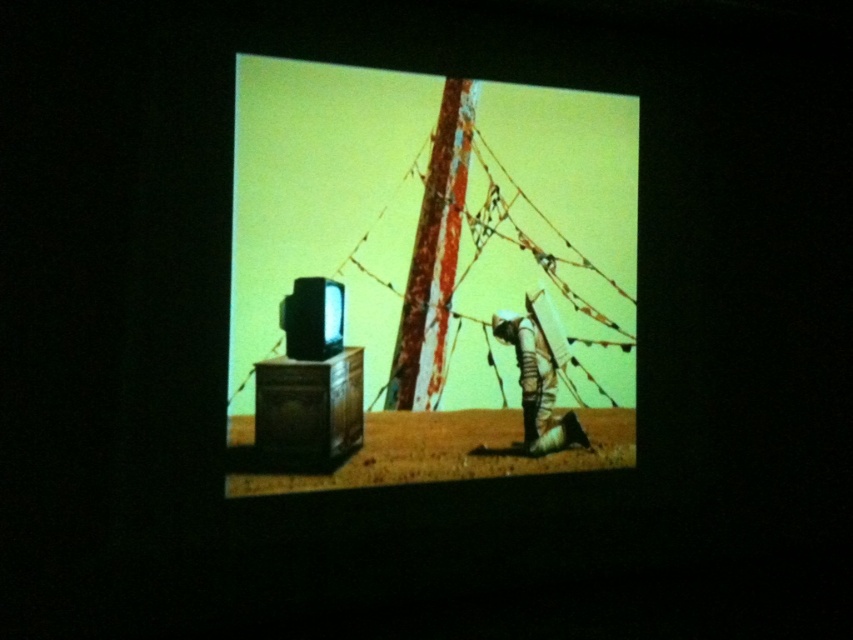
Question: Does metallic silver tv at center-left lie in front of camouflage fabric person at center?

Choices:
 (A) no
 (B) yes

Answer: (B)

Question: Which object appears closest to the camera in this image?

Choices:
 (A) metallic silver tv at center-left
 (B) camouflage fabric person at center

Answer: (A)

Question: Does metallic silver tv at center-left appear over camouflage fabric person at center?

Choices:
 (A) yes
 (B) no

Answer: (A)

Question: Where is metallic silver tv at center-left located in relation to camouflage fabric person at center in the image?

Choices:
 (A) left
 (B) right

Answer: (A)